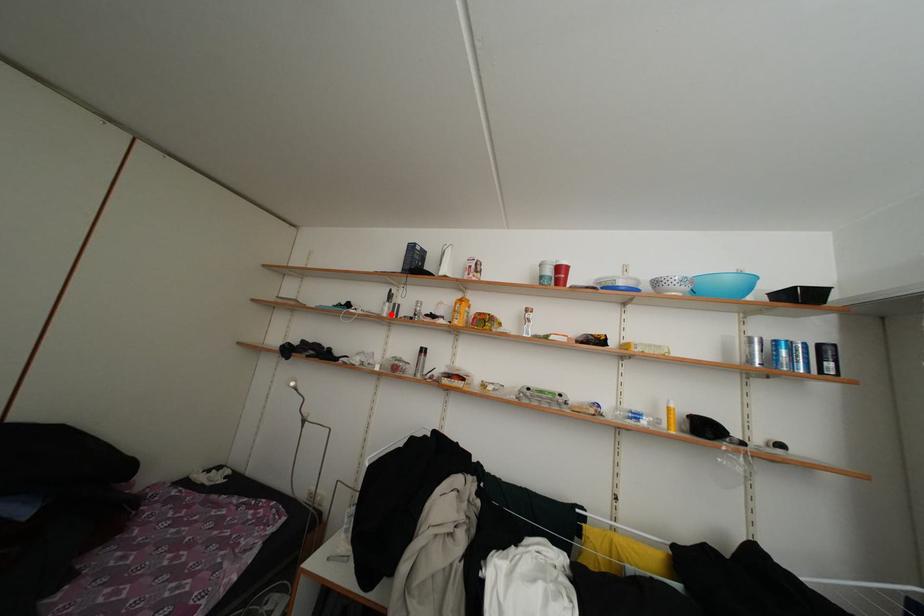
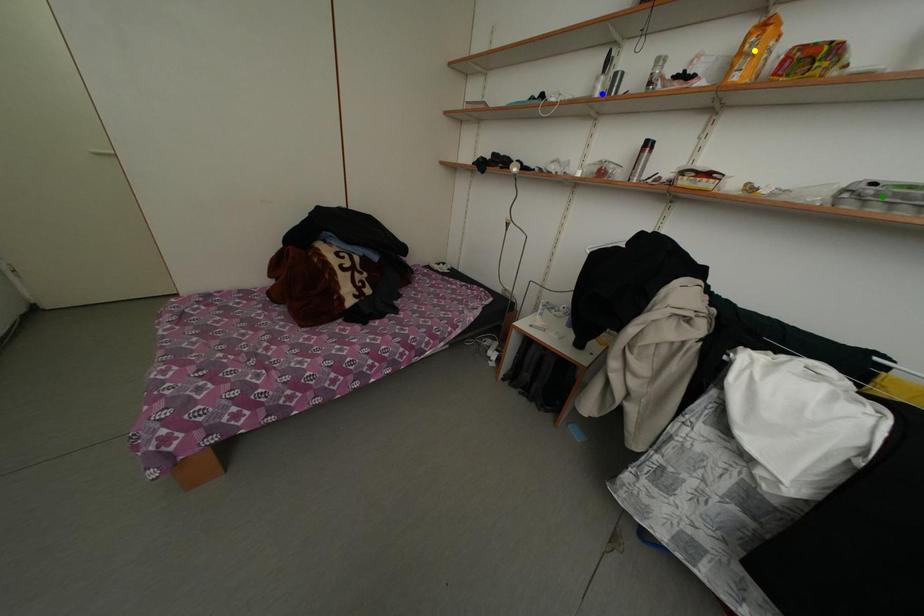
Question: I am providing you with two images of the same scene from different viewpoints. A red point is marked on the first image. You are given multiple points on the second image. Which point in image 2 represents the same 3d spot as the red point in image 1?

Choices:
 (A) blue point
 (B) green point
 (C) yellow point

Answer: (A)